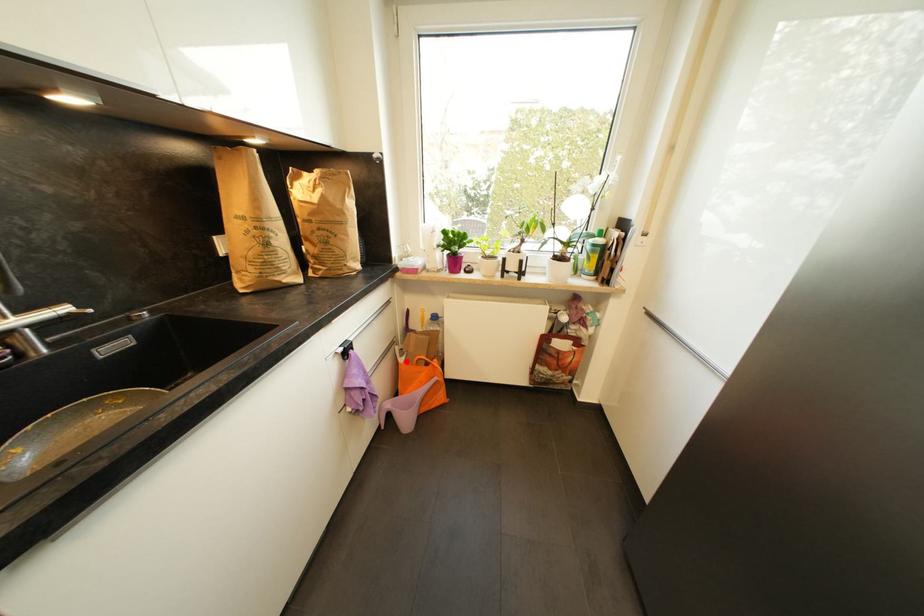
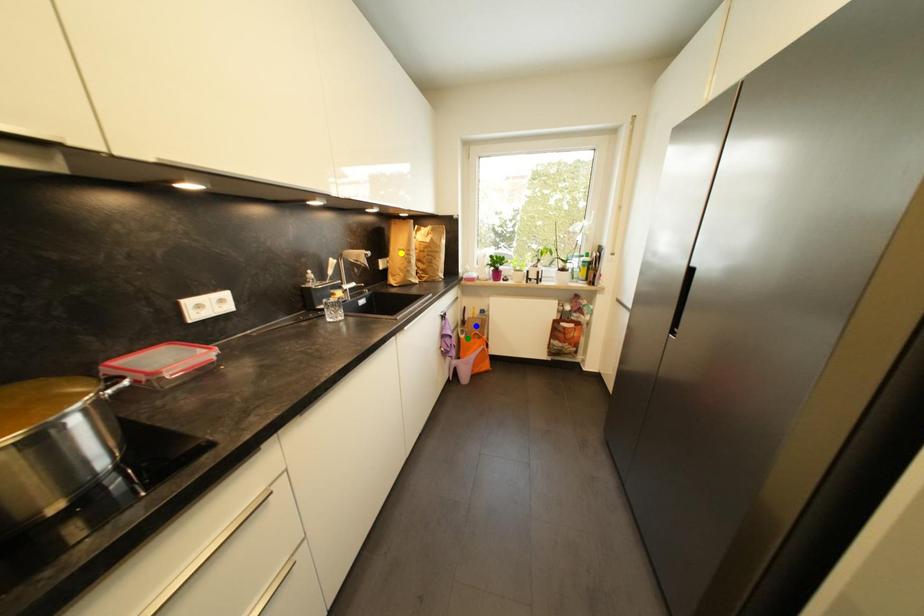
Question: I am providing you with two images of the same scene from different viewpoints. A red point is marked on the first image. You are given multiple points on the second image. Which point in image 2 is actually the same real-world point as the red point in image 1?

Choices:
 (A) green point
 (B) yellow point
 (C) blue point

Answer: (A)